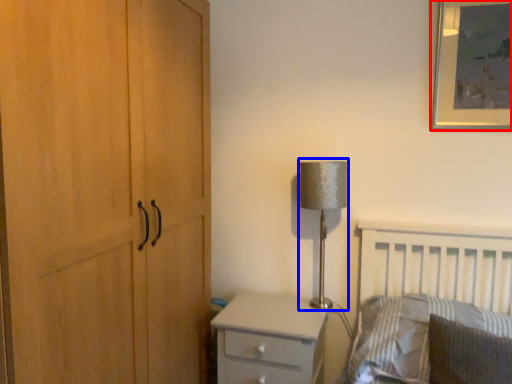
Question: Among these objects, which one is farthest to the camera, picture frame (highlighted by a red box) or table lamp (highlighted by a blue box)?

Choices:
 (A) picture frame
 (B) table lamp

Answer: (B)